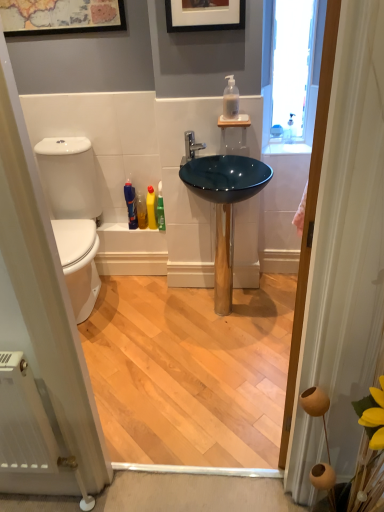
The height and width of the screenshot is (512, 384). I want to click on empty space that is ontop of translucent glass soap dispenser at upper right (from a real-world perspective), so click(x=294, y=140).